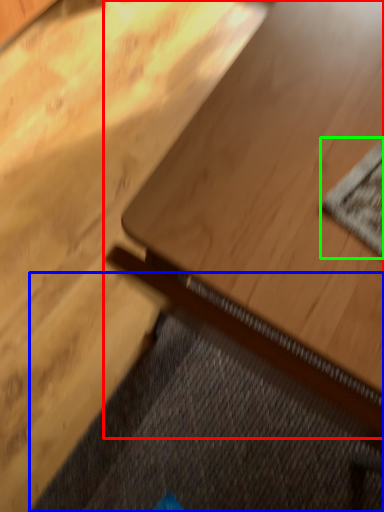
Question: Which object is positioned closest to table (highlighted by a red box)? Select from doormat (highlighted by a blue box) and mat (highlighted by a green box).

Choices:
 (A) doormat
 (B) mat

Answer: (B)